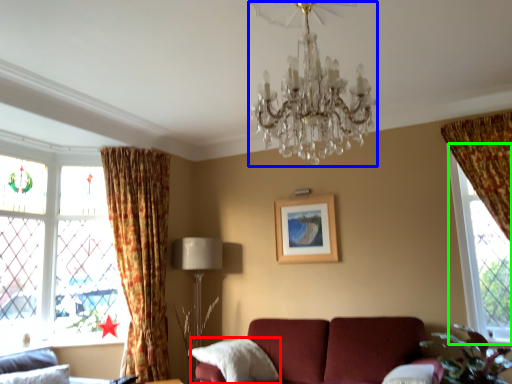
Question: Based on their relative distances, which object is farther from pillow (highlighted by a red box)? Choose from chandelier (highlighted by a blue box) and window (highlighted by a green box).

Choices:
 (A) chandelier
 (B) window

Answer: (A)